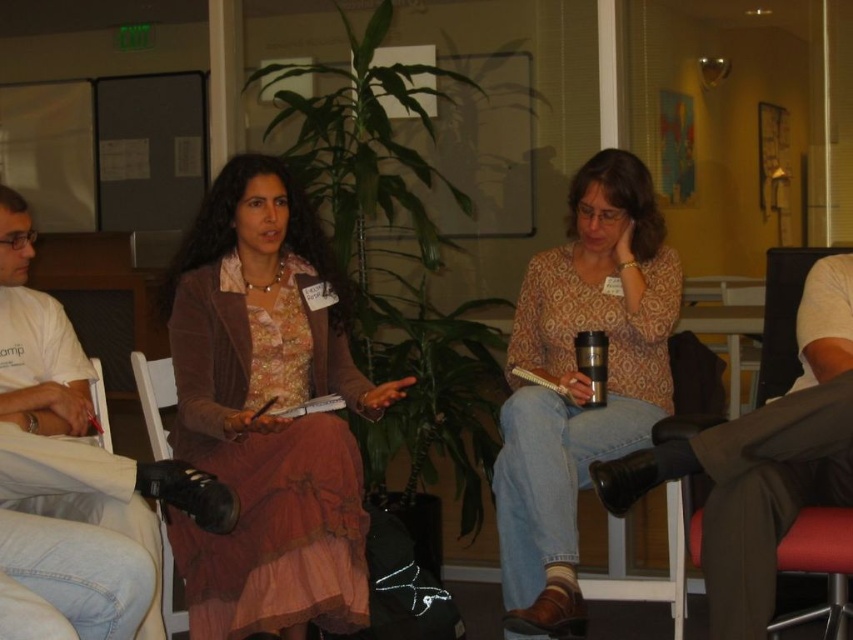
You are a photographer trying to capture a closeup of the patterned fabric blouse at center and the silver metallic cup at center. Since you want to focus on the blouse, which object should you adjust your camera settings to prioritize in terms of focus distance?

The patterned fabric blouse at center is taller than the silver metallic cup at center, so to prioritize focusing on the blouse, adjust the camera settings to focus on the taller object.

You are organizing a photoshoot and need to ensure that the patterned fabric blouse at center and the brown leather chair at lower right are both visible in the frame. Given their sizes, which object should you prioritize positioning closer to the camera to maintain clarity?

The patterned fabric blouse at center should be positioned closer to the camera since it is bigger than the brown leather chair at lower right, ensuring its details remain clear.

You are sitting at the table and want to reach for the silver metallic cup at center without moving your chair. Can you easily grab it while keeping your hands near the matte pink dress at center?

The matte pink dress at center is in front of the silver metallic cup at center, so you can easily reach the silver metallic cup at center by moving your hand slightly backward from the position near the matte pink dress at center.